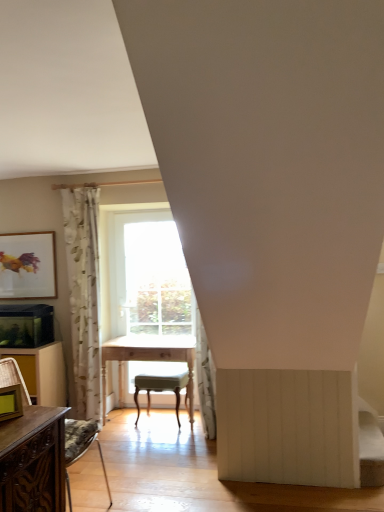
Question: Is brown wood dresser at lower left surrounded by matte gold picture frame at left, the 2th picture frame positioned from the right?

Choices:
 (A) yes
 (B) no

Answer: (B)

Question: Is matte gold picture frame at left, the second picture frame positioned from the front, smaller than brown wood dresser at lower left?

Choices:
 (A) yes
 (B) no

Answer: (A)

Question: Is matte gold picture frame at left, placed as the 1th picture frame when sorted from back to front, positioned in front of brown wood dresser at lower left?

Choices:
 (A) yes
 (B) no

Answer: (B)

Question: Is matte gold picture frame at left, the second picture frame positioned from the front, touching brown wood dresser at lower left?

Choices:
 (A) no
 (B) yes

Answer: (A)

Question: Considering the relative sizes of matte gold picture frame at left, marked as the first picture frame in a top-to-bottom arrangement, and brown wood dresser at lower left in the image provided, is matte gold picture frame at left, marked as the first picture frame in a top-to-bottom arrangement, wider than brown wood dresser at lower left?

Choices:
 (A) no
 (B) yes

Answer: (A)

Question: Is matte gold picture frame at left, which is the first picture frame from left to right, outside of brown wood dresser at lower left?

Choices:
 (A) no
 (B) yes

Answer: (B)

Question: Are matte gold picture frame at lower left, the 1th picture frame from the right, and wooden chair at left located far from each other?

Choices:
 (A) yes
 (B) no

Answer: (A)

Question: Is wooden chair at left located within matte gold picture frame at lower left, which is counted as the second picture frame, starting from the left?

Choices:
 (A) yes
 (B) no

Answer: (B)

Question: Is matte gold picture frame at lower left, the 1th picture frame from the right, facing away from wooden chair at left?

Choices:
 (A) yes
 (B) no

Answer: (B)

Question: Can you confirm if matte gold picture frame at lower left, placed as the second picture frame when sorted from back to front, is shorter than wooden chair at left?

Choices:
 (A) yes
 (B) no

Answer: (A)

Question: Considering the relative positions of matte gold picture frame at lower left, which is counted as the 1th picture frame, starting from the bottom, and wooden chair at left in the image provided, is matte gold picture frame at lower left, which is counted as the 1th picture frame, starting from the bottom, behind wooden chair at left?

Choices:
 (A) yes
 (B) no

Answer: (B)

Question: Considering the relative sizes of matte gold picture frame at lower left, which is counted as the second picture frame, starting from the left, and wooden chair at left in the image provided, is matte gold picture frame at lower left, which is counted as the second picture frame, starting from the left, thinner than wooden chair at left?

Choices:
 (A) yes
 (B) no

Answer: (A)

Question: Is brown wood dresser at lower left wider than matte gold picture frame at lower left, placed as the second picture frame when sorted from back to front?

Choices:
 (A) yes
 (B) no

Answer: (A)